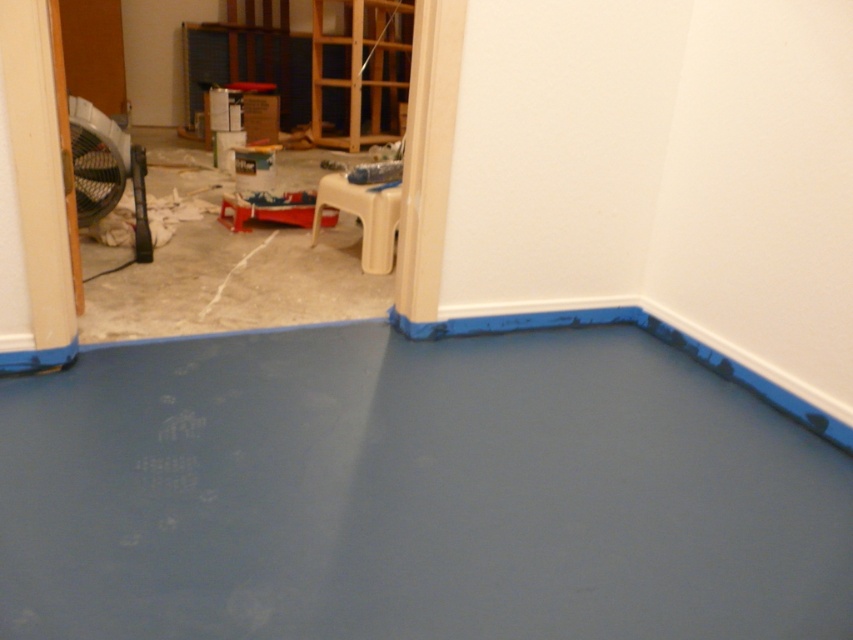
Question: Which point is farther from the camera taking this photo?

Choices:
 (A) (257, 269)
 (B) (90, 225)

Answer: (B)

Question: Among these points, which one is nearest to the camera?

Choices:
 (A) 138,182
 (B) 296,250
 (C) 711,432

Answer: (C)

Question: Which of the following is the closest to the observer?

Choices:
 (A) matte black fan at left
 (B) white concrete floor at left
 (C) smooth concrete floor at center

Answer: (C)

Question: Does white concrete floor at left appear over matte black fan at left?

Choices:
 (A) no
 (B) yes

Answer: (B)

Question: Does smooth concrete floor at center have a lesser width compared to white concrete floor at left?

Choices:
 (A) yes
 (B) no

Answer: (B)

Question: Is the position of white concrete floor at left more distant than that of matte black fan at left?

Choices:
 (A) no
 (B) yes

Answer: (A)